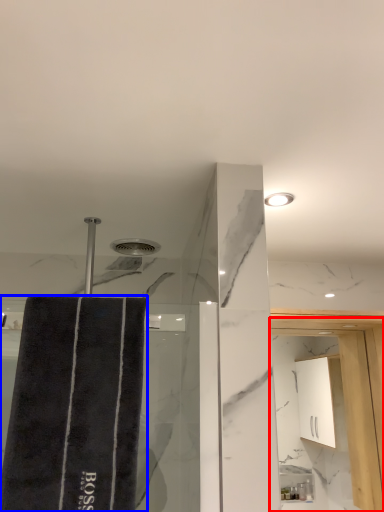
Question: Which object appears farthest to the camera in this image, screen door (highlighted by a red box) or bath towel (highlighted by a blue box)?

Choices:
 (A) screen door
 (B) bath towel

Answer: (A)